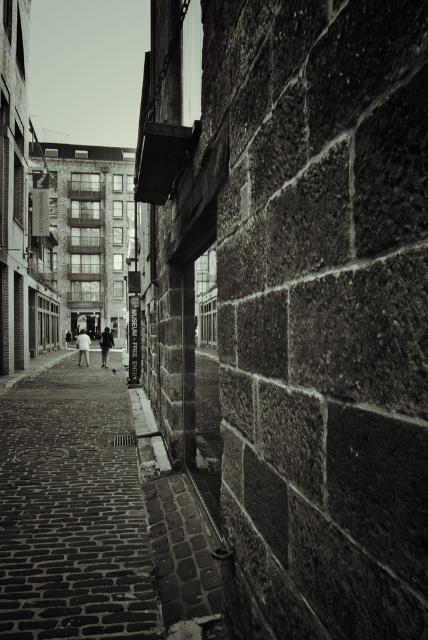
Question: Is smooth cobblestone pavement at center below dark gray fabric jacket at center?

Choices:
 (A) yes
 (B) no

Answer: (A)

Question: Is smooth cobblestone pavement at center closer to the viewer compared to white cotton shirt at center?

Choices:
 (A) yes
 (B) no

Answer: (A)

Question: Which point appears farthest from the camera in this image?

Choices:
 (A) (79, 346)
 (B) (121, 465)
 (C) (107, 353)

Answer: (A)

Question: Among these objects, which one is nearest to the camera?

Choices:
 (A) white cotton shirt at center
 (B) smooth cobblestone pavement at center

Answer: (B)

Question: Is white cotton shirt at center below dark gray fabric jacket at center?

Choices:
 (A) yes
 (B) no

Answer: (B)

Question: Which of the following is the farthest from the observer?

Choices:
 (A) dark gray fabric jacket at center
 (B) smooth cobblestone pavement at center

Answer: (A)